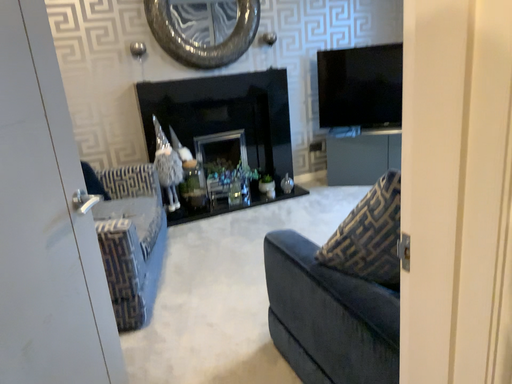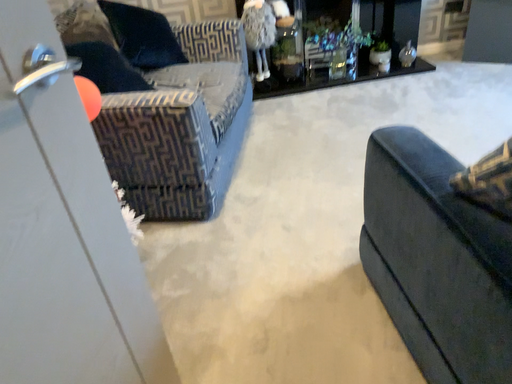
Question: Which way did the camera rotate in the video?

Choices:
 (A) rotated right
 (B) rotated left

Answer: (B)